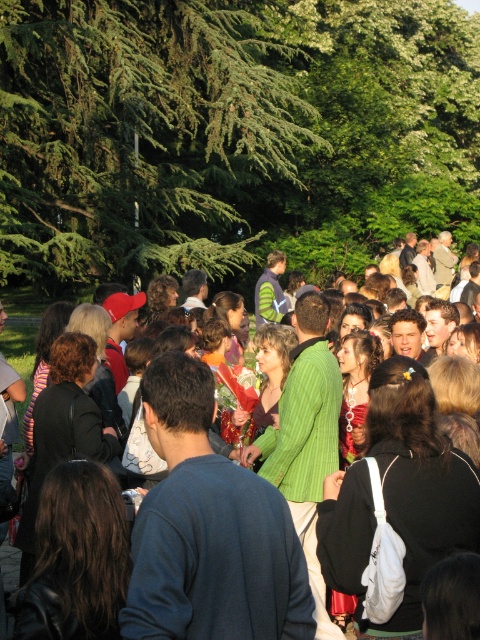
Can you confirm if green leafy tree at upper left is positioned to the right of green textured sweater at center?

In fact, green leafy tree at upper left is to the left of green textured sweater at center.

Does green leafy tree at upper left have a greater width compared to green textured sweater at center?

Yes.

Is point (192, 248) in front of point (276, 444)?

No, (192, 248) is further to viewer.

The width and height of the screenshot is (480, 640). I want to click on green leafy tree at upper left, so click(142, 132).